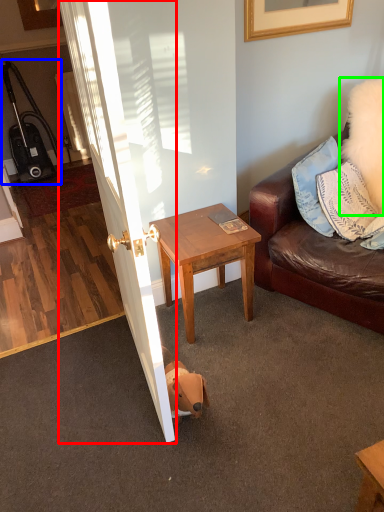
Question: Which is farther away from door (highlighted by a red box)? luggage (highlighted by a blue box) or pillow (highlighted by a green box)?

Choices:
 (A) luggage
 (B) pillow

Answer: (A)